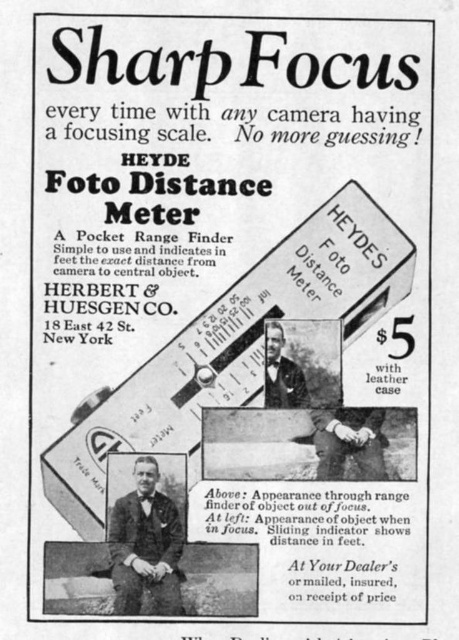
Who is positioned more to the right, light brown leather gloves at center or black leather jacket at center?

Positioned to the right is light brown leather gloves at center.

The width and height of the screenshot is (459, 640). In order to click on light brown leather gloves at center in this screenshot , I will do `click(350, 442)`.

Locate an element on the screen. This screenshot has height=640, width=459. light brown leather gloves at center is located at coordinates 350,442.

Can you confirm if black suit at center is positioned below black leather jacket at center?

Correct, black suit at center is located below black leather jacket at center.

Can you confirm if black suit at center is positioned above black leather jacket at center?

No.

What do you see at coordinates (145, 545) in the screenshot? The width and height of the screenshot is (459, 640). I see `black suit at center` at bounding box center [145, 545].

The height and width of the screenshot is (640, 459). Identify the location of black suit at center. (145, 545).

Does black suit at center appear under light brown leather gloves at center?

Indeed, black suit at center is positioned under light brown leather gloves at center.

Between point (133, 588) and point (323, 436), which one is positioned behind?

The point (323, 436) is behind.

In order to click on black suit at center in this screenshot , I will do `click(145, 545)`.